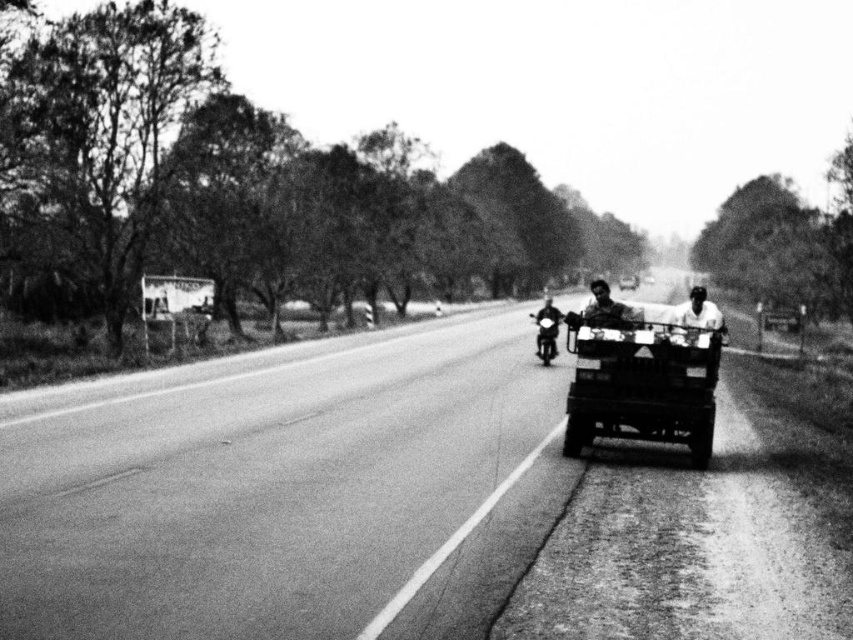
Does metallic flatbed cart at center appear over smooth skin face at center?

No, metallic flatbed cart at center is not above smooth skin face at center.

Is metallic flatbed cart at center to the right of smooth skin face at center from the viewer's perspective?

Incorrect, metallic flatbed cart at center is not on the right side of smooth skin face at center.

This screenshot has height=640, width=853. What do you see at coordinates (640, 378) in the screenshot?
I see `metallic flatbed cart at center` at bounding box center [640, 378].

Where is `metallic flatbed cart at center`? metallic flatbed cart at center is located at coordinates (640, 378).

What do you see at coordinates (640, 378) in the screenshot? This screenshot has height=640, width=853. I see `metallic flatbed cart at center` at bounding box center [640, 378].

Can you confirm if metallic flatbed cart at center is taller than metallic silver motorcycle at center?

Incorrect, metallic flatbed cart at center's height is not larger of metallic silver motorcycle at center's.

The width and height of the screenshot is (853, 640). Find the location of `metallic flatbed cart at center`. metallic flatbed cart at center is located at coordinates (640, 378).

Can you confirm if smooth skin face at center is positioned to the left of metallic silver motorcycle at center?

No, smooth skin face at center is not to the left of metallic silver motorcycle at center.

Between smooth skin face at center and metallic silver motorcycle at center, which one has less height?

metallic silver motorcycle at center is shorter.

Describe the element at coordinates (699, 312) in the screenshot. I see `smooth skin face at center` at that location.

Identify the location of smooth skin face at center. The image size is (853, 640). (699, 312).